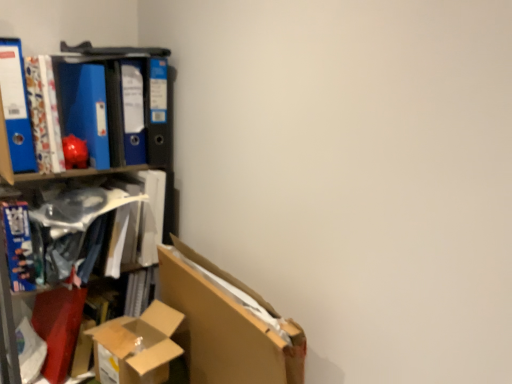
Question: Considering the relative positions of blue glossy book at left, acting as the second book starting from the right, and cardboard box at lower left in the image provided, is blue glossy book at left, acting as the second book starting from the right, to the right of cardboard box at lower left from the viewer's perspective?

Choices:
 (A) yes
 (B) no

Answer: (B)

Question: Is blue glossy book at left, which ranks as the first book in left-to-right order, surrounding cardboard box at lower left?

Choices:
 (A) no
 (B) yes

Answer: (A)

Question: From the image's perspective, is blue glossy book at left, acting as the second book starting from the right, below cardboard box at lower left?

Choices:
 (A) no
 (B) yes

Answer: (A)

Question: Is blue glossy book at left, acting as the second book starting from the right, completely or partially outside of cardboard box at lower left?

Choices:
 (A) yes
 (B) no

Answer: (A)

Question: From a real-world perspective, is blue glossy book at left, which ranks as the first book in left-to-right order, on top of cardboard box at lower left?

Choices:
 (A) no
 (B) yes

Answer: (B)

Question: From a real-world perspective, is blue matte folder at upper left, positioned as the second paperback book in right-to-left order, physically located above or below cardboard box at lower left?

Choices:
 (A) above
 (B) below

Answer: (A)

Question: Visually, is blue matte folder at upper left, positioned as the second paperback book in right-to-left order, positioned to the left or to the right of cardboard box at lower left?

Choices:
 (A) right
 (B) left

Answer: (B)

Question: Is blue matte folder at upper left, positioned as the second paperback book in right-to-left order, inside or outside of cardboard box at lower left?

Choices:
 (A) outside
 (B) inside

Answer: (A)

Question: In terms of width, does blue matte folder at upper left, positioned as the second paperback book in right-to-left order, look wider or thinner when compared to cardboard box at lower left?

Choices:
 (A) thin
 (B) wide

Answer: (A)

Question: From the image's perspective, is blue matte folder at upper left, marked as the 2th paperback book in a left-to-right arrangement, located above or below matte plastic book at left, the first book when ordered from right to left?

Choices:
 (A) below
 (B) above

Answer: (B)

Question: Considering their positions, is blue matte folder at upper left, positioned as the second paperback book in right-to-left order, located in front of or behind matte plastic book at left, the first book when ordered from right to left?

Choices:
 (A) front
 (B) behind

Answer: (B)

Question: Looking at the image, does blue matte folder at upper left, positioned as the second paperback book in right-to-left order, seem bigger or smaller compared to matte plastic book at left, the first book when ordered from right to left?

Choices:
 (A) small
 (B) big

Answer: (A)

Question: Do you think blue matte folder at upper left, marked as the 2th paperback book in a left-to-right arrangement, is within matte plastic book at left, which is the 2th book from left to right, or outside of it?

Choices:
 (A) outside
 (B) inside

Answer: (A)

Question: Considering the positions of matte plastic book at left, the first book when ordered from right to left, and cardboard box at lower left in the image, is matte plastic book at left, the first book when ordered from right to left, taller or shorter than cardboard box at lower left?

Choices:
 (A) tall
 (B) short

Answer: (B)

Question: Is matte plastic book at left, the first book when ordered from right to left, wider or thinner than cardboard box at lower left?

Choices:
 (A) thin
 (B) wide

Answer: (B)